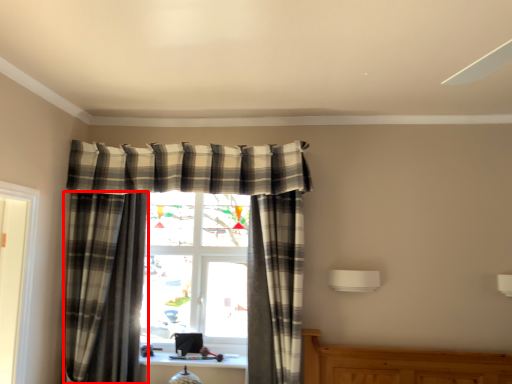
Question: From the image's perspective, what is the correct spatial relationship of curtain (annotated by the red box) in relation to curtain?

Choices:
 (A) above
 (B) below

Answer: (A)